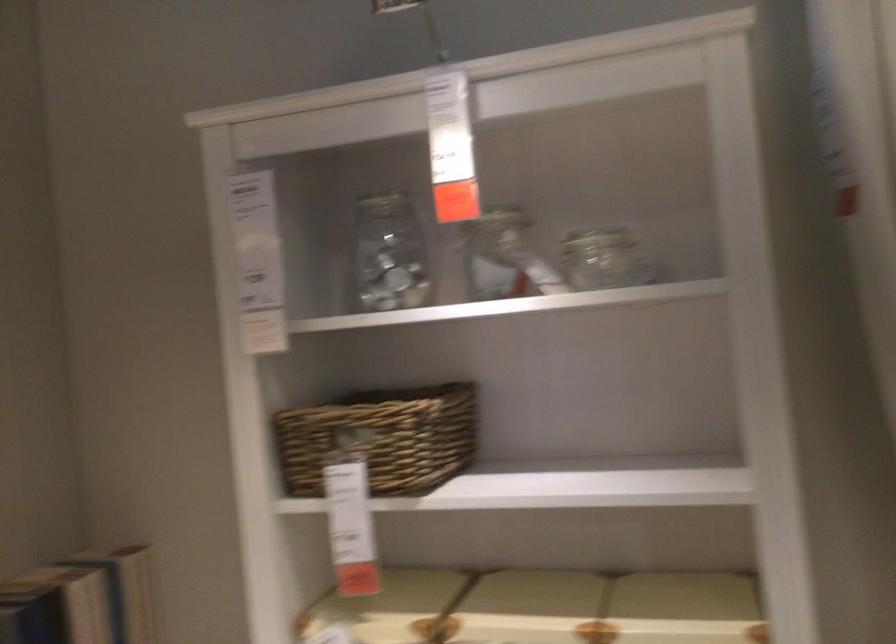
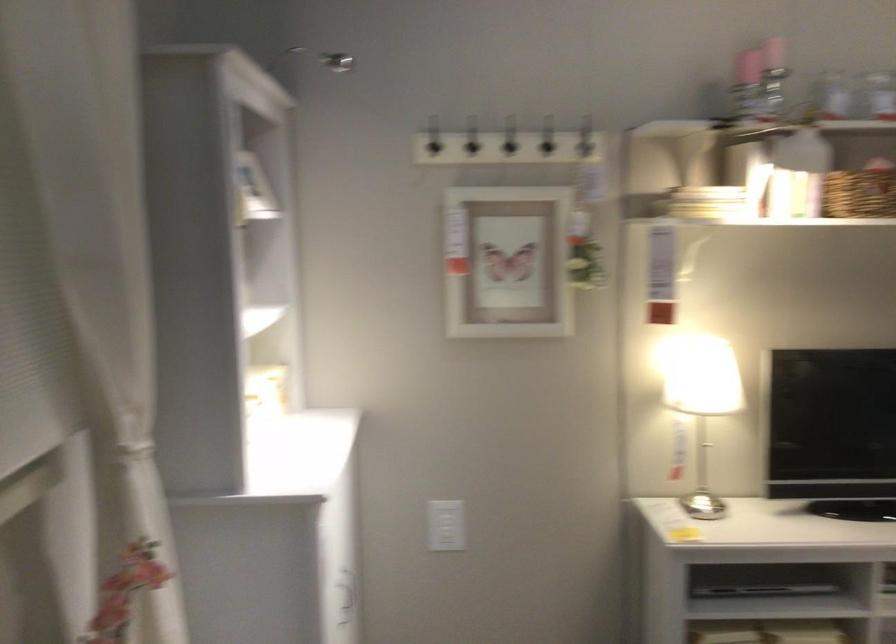
Question: How did the camera likely rotate?

Choices:
 (A) Left
 (B) Right
 (C) Up
 (D) Down

Answer: (B)